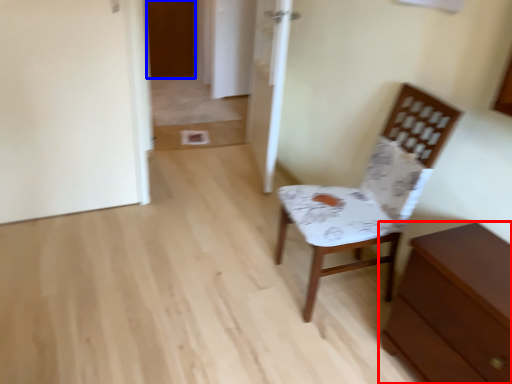
Question: Among these objects, which one is farthest to the camera, chest of drawers (highlighted by a red box) or door (highlighted by a blue box)?

Choices:
 (A) chest of drawers
 (B) door

Answer: (B)